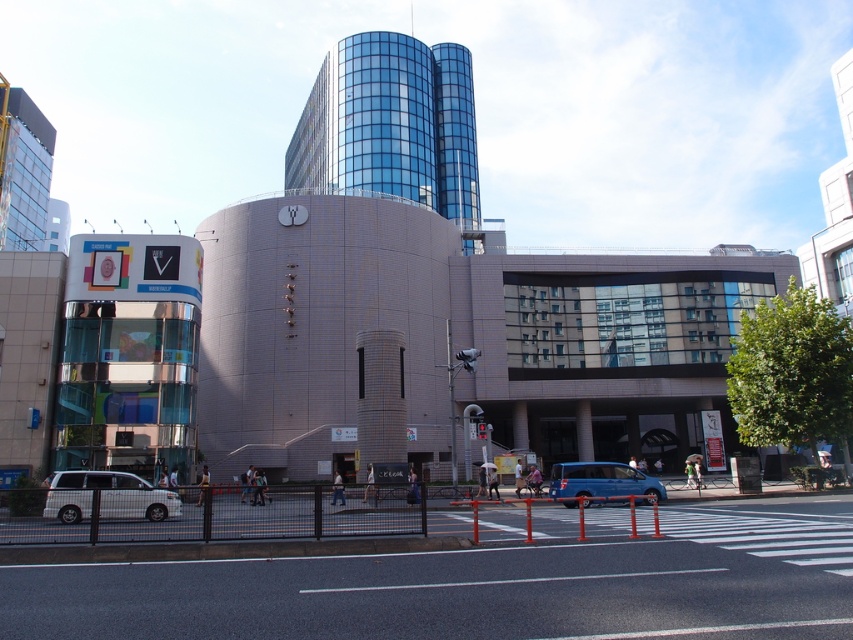
Question: Can you confirm if white matte van at lower left is smaller than blue metallic van at center?

Choices:
 (A) no
 (B) yes

Answer: (B)

Question: Does white matte van at lower left have a larger size compared to blue metallic van at center?

Choices:
 (A) yes
 (B) no

Answer: (B)

Question: Is white matte van at lower left above blue metallic van at center?

Choices:
 (A) yes
 (B) no

Answer: (A)

Question: Which point is farther to the camera?

Choices:
 (A) (61, 499)
 (B) (596, 464)

Answer: (B)